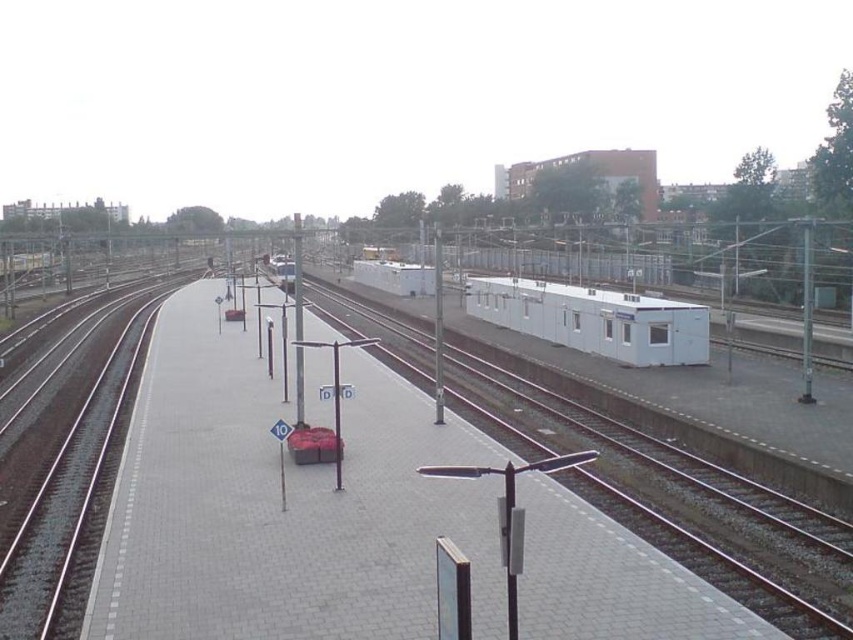
Question: In this image, where is smooth concrete train track at left located relative to white matte container at center?

Choices:
 (A) left
 (B) right

Answer: (A)

Question: Among these objects, which one is nearest to the camera?

Choices:
 (A) smooth concrete train track at left
 (B) metal train track at center

Answer: (B)

Question: Which point is farther to the camera?

Choices:
 (A) 566,330
 (B) 509,428

Answer: (A)

Question: Among these points, which one is farthest from the camera?

Choices:
 (A) (59, 636)
 (B) (498, 420)
 (C) (646, 314)

Answer: (C)

Question: Is metal train track at center below white matte container at center?

Choices:
 (A) no
 (B) yes

Answer: (B)

Question: Does metal train track at center appear over white matte container at center?

Choices:
 (A) yes
 (B) no

Answer: (B)